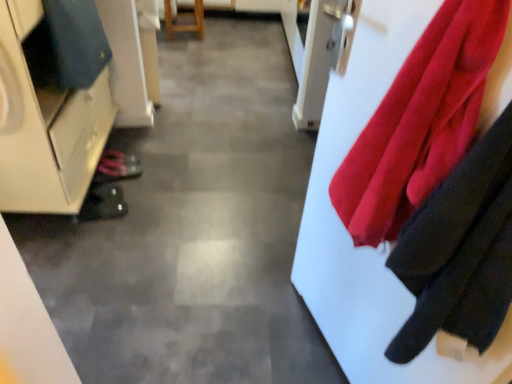
Identify the location of unoccupied region to the right of shiny black shoe at lower left, the 1th shoe positioned from the top. tap(156, 179).